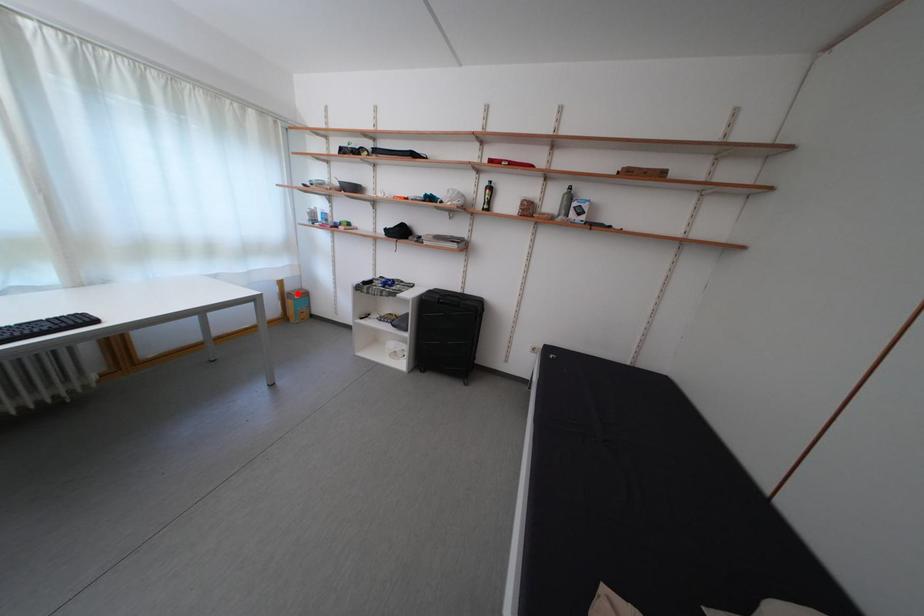
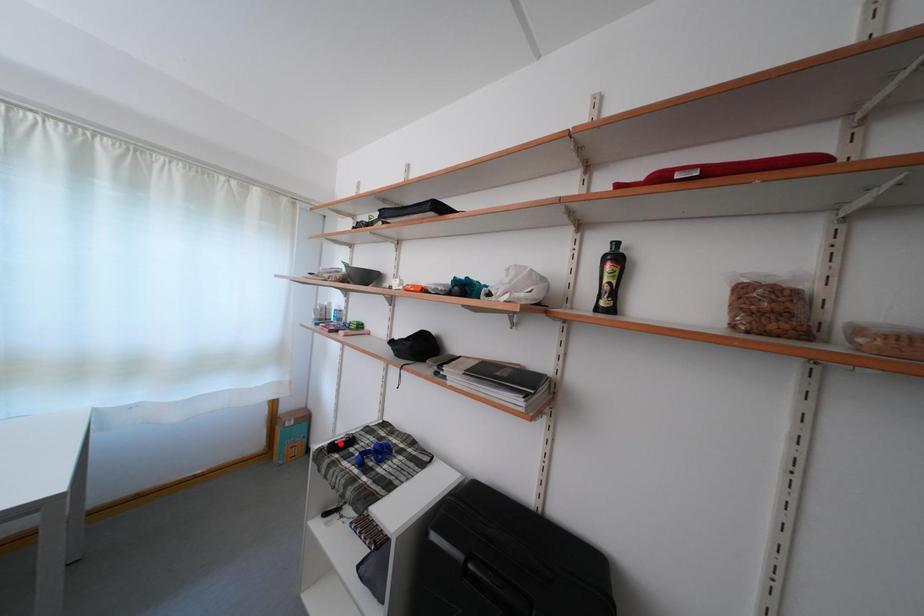
I am providing you with two images of the same scene from different viewpoints. A red point is marked on the first image and another point is marked on the second image. Is the marked point in image1 the same physical position as the marked point in image2?

No